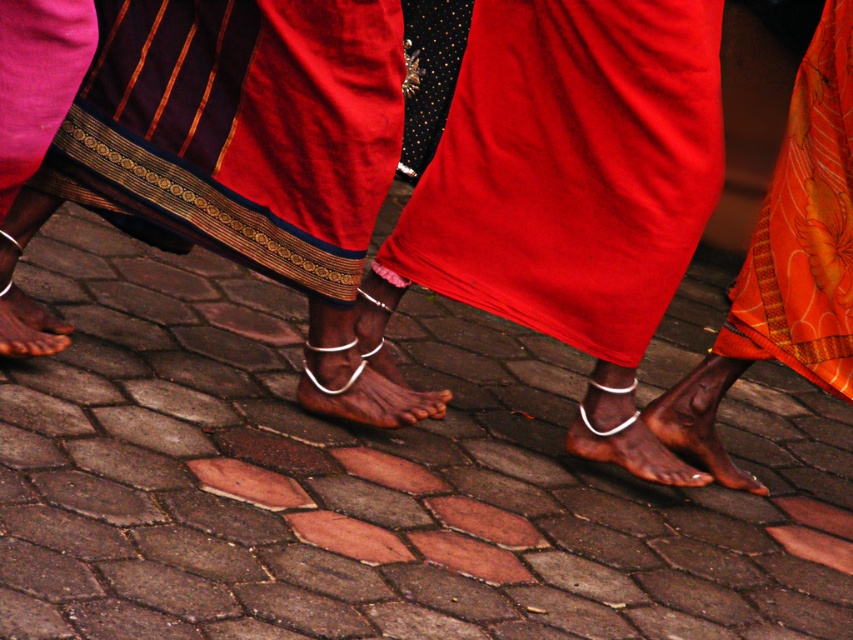
Question: Which of the following is the farthest from the observer?

Choices:
 (A) matte red fabric at center
 (B) velvet-like red skirt at center
 (C) orange floral fabric at lower right
 (D) white metallic anklet at center

Answer: (D)

Question: Is orange floral fabric at lower right positioned before silver metallic anklet at center?

Choices:
 (A) no
 (B) yes

Answer: (A)

Question: Is white metallic anklet at center in front of brown matte foot at lower left?

Choices:
 (A) no
 (B) yes

Answer: (A)

Question: From the image, what is the correct spatial relationship of brown hexagonal paving stone at center in relation to brown matte foot at lower left?

Choices:
 (A) above
 (B) below

Answer: (B)

Question: Which point is farther from the camera taking this photo?

Choices:
 (A) (602, 454)
 (B) (331, 97)
 (C) (788, 483)

Answer: (C)

Question: Which point is closer to the camera?

Choices:
 (A) (788, 272)
 (B) (299, 401)
 (C) (375, 13)

Answer: (C)